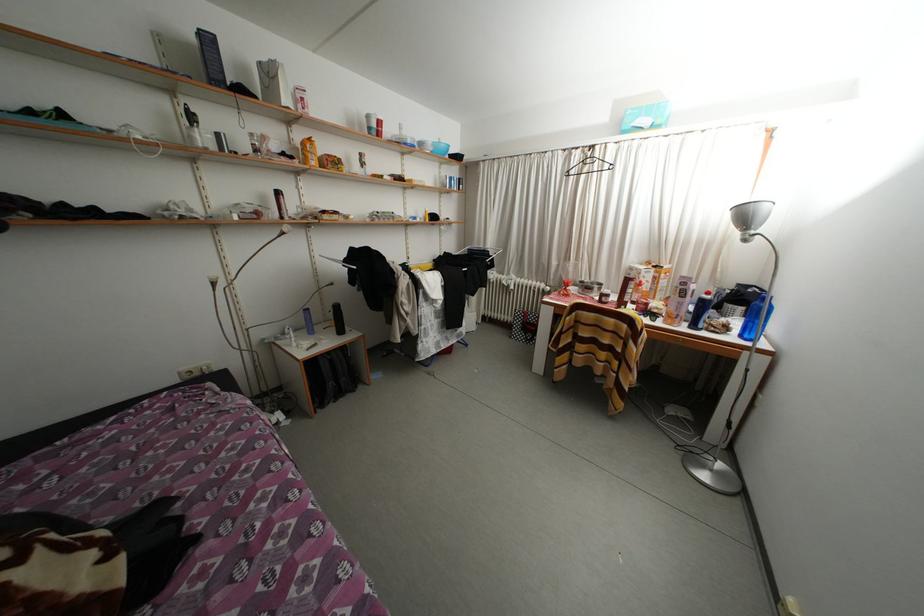
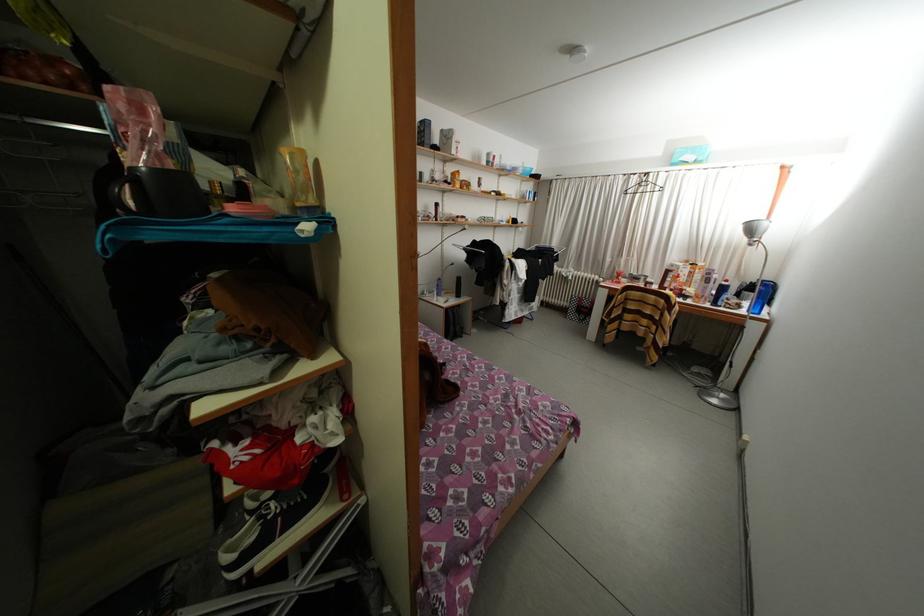
Question: I am providing you with two images of the same scene from different viewpoints. Which of the following objects are not visible in image2?

Choices:
 (A) red bowl
 (B) silver lamp head
 (C) black mug handle
 (D) none of these

Answer: (D)